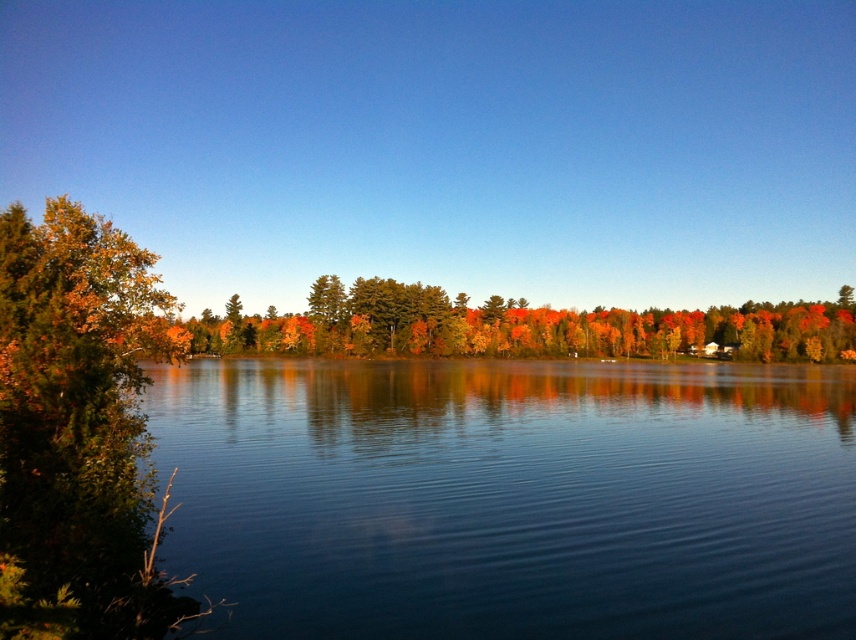
You are standing at the lakeside and want to take a photo of the point at coordinates point [789,426]. If your camera has a maximum focus range of 35 meters, will you be able to focus on that point?

The distance of point [789,426] from camera is 37.40 meters, which exceeds the camera maximum focus range of 35 meters. Therefore, you cannot focus on that point.

You are standing at the lakeside and notice two points in the scene. The first point is at coordinates point (220, 410), and the second is at point (27, 552). Which point is closer to you?

Point (27, 552) is closer to you because it is in front of point (220, 410).

Based on the photo, you are an artist planning to paint the lakeside scene. You want to ensure the clear water at center and the green leafy tree at left are proportionally accurate. Which object should you paint first to maintain the correct size relationship?

You should paint the green leafy tree at left first because the clear water at center is larger in size, so starting with the smaller object ensures proper scaling when adding the larger one.